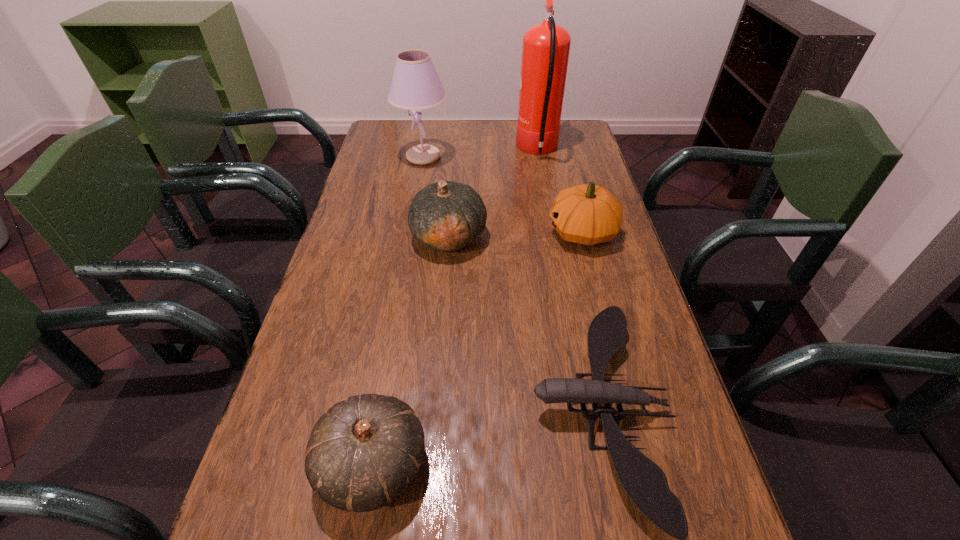
Identify the location of fire extinguisher. This screenshot has width=960, height=540. (545, 48).

Locate an element on the screen. The height and width of the screenshot is (540, 960). the fifth shortest object is located at coordinates (415, 85).

Identify the location of the rightmost gourd. The image size is (960, 540). (587, 214).

Locate an element on the screen. The height and width of the screenshot is (540, 960). the nearest gourd is located at coordinates (364, 452).

I want to click on vacant region located 0.300m towards the nozzle of the tallest object, so click(430, 150).

Locate an element on the screen. This screenshot has height=540, width=960. free location located 0.250m towards the nozzle of the tallest object is located at coordinates (444, 150).

The image size is (960, 540). Find the location of `vacant area situated 0.350m towards the nozzle of the tallest object`. vacant area situated 0.350m towards the nozzle of the tallest object is located at coordinates (416, 150).

Image resolution: width=960 pixels, height=540 pixels. I want to click on blank area located 0.280m on the front of the fifth shortest object, so click(412, 225).

Locate an element on the screen. This screenshot has height=540, width=960. free space located on the side of the rightmost gourd with the carved face is located at coordinates tap(456, 232).

Identify the location of free space located 0.070m on the side of the rightmost gourd with the carved face. (521, 232).